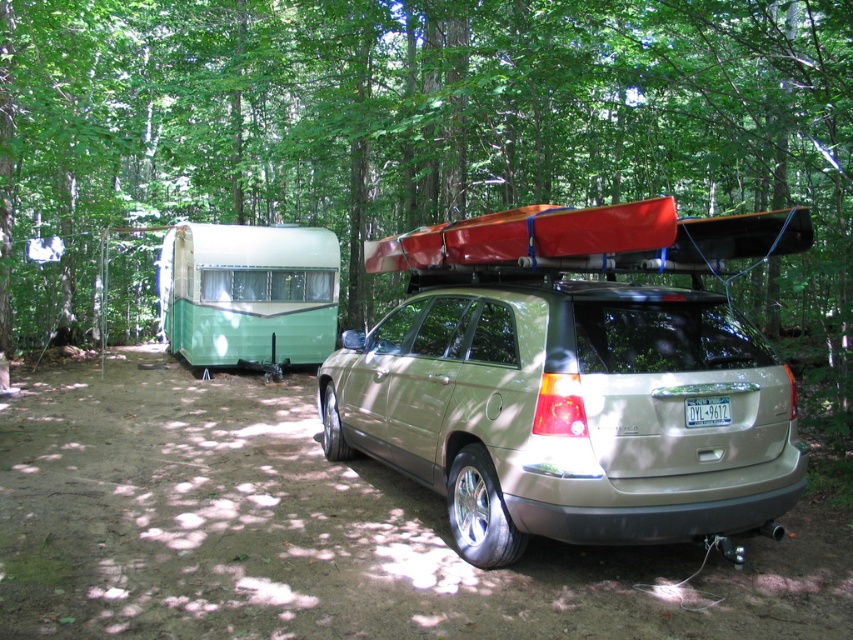
From the picture: Who is higher up, green leafy tree at upper center or satin gold suv at center?

green leafy tree at upper center is higher up.

Who is lower down, green leafy tree at upper center or satin gold suv at center?

satin gold suv at center is lower down.

Measure the distance between green leafy tree at upper center and camera.

5.54 meters

The width and height of the screenshot is (853, 640). What are the coordinates of `green leafy tree at upper center` in the screenshot? It's located at (426, 134).